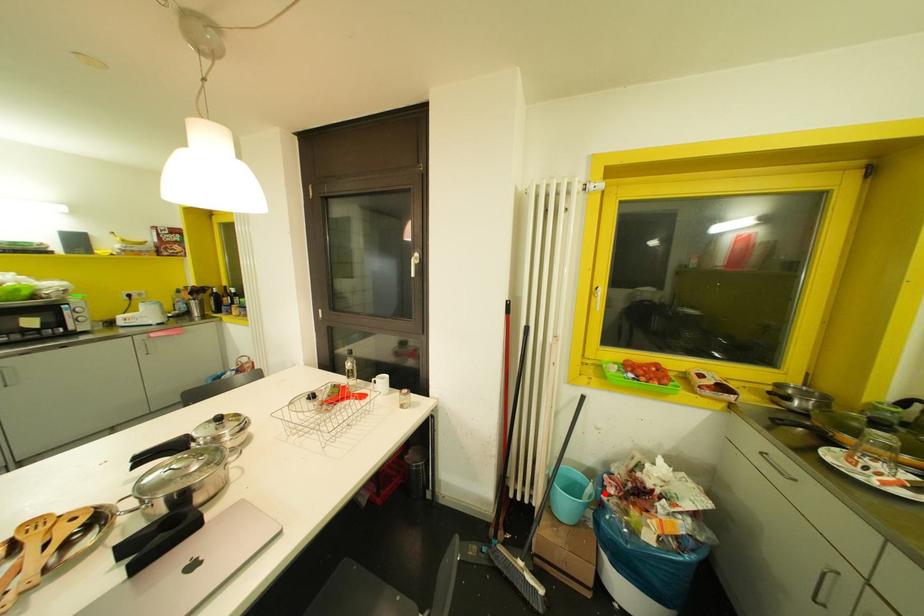
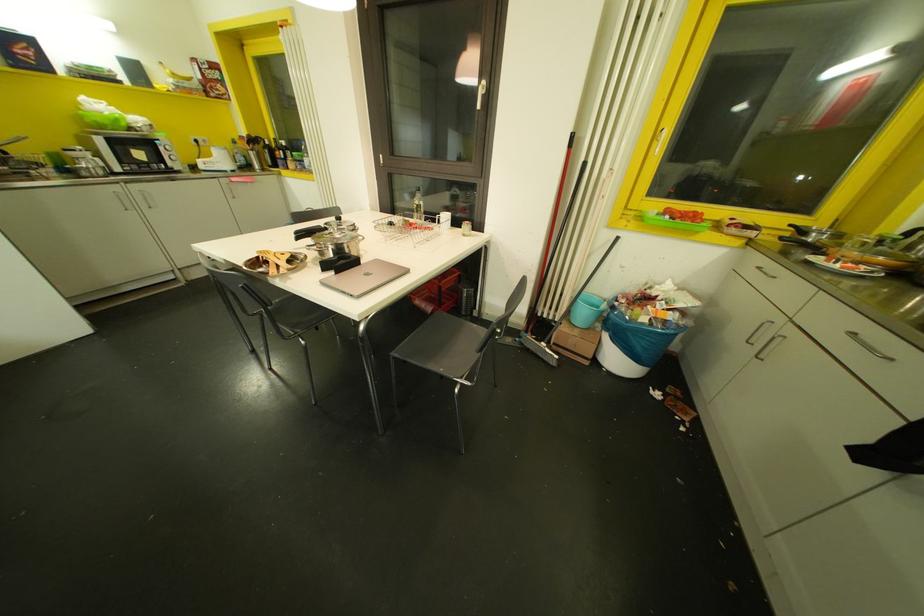
Where in the second image is the point corresponding to the highlighted location from the first image?

(614, 302)